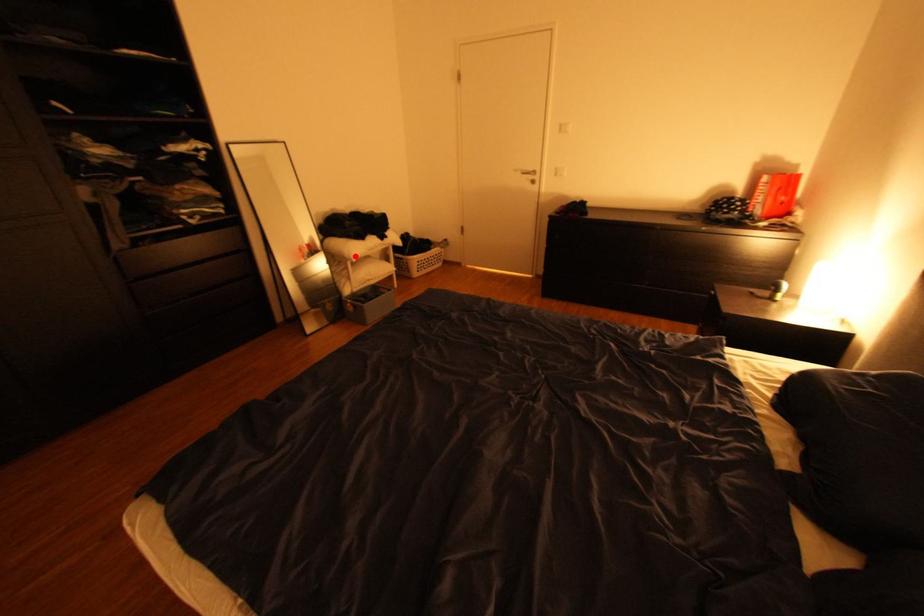
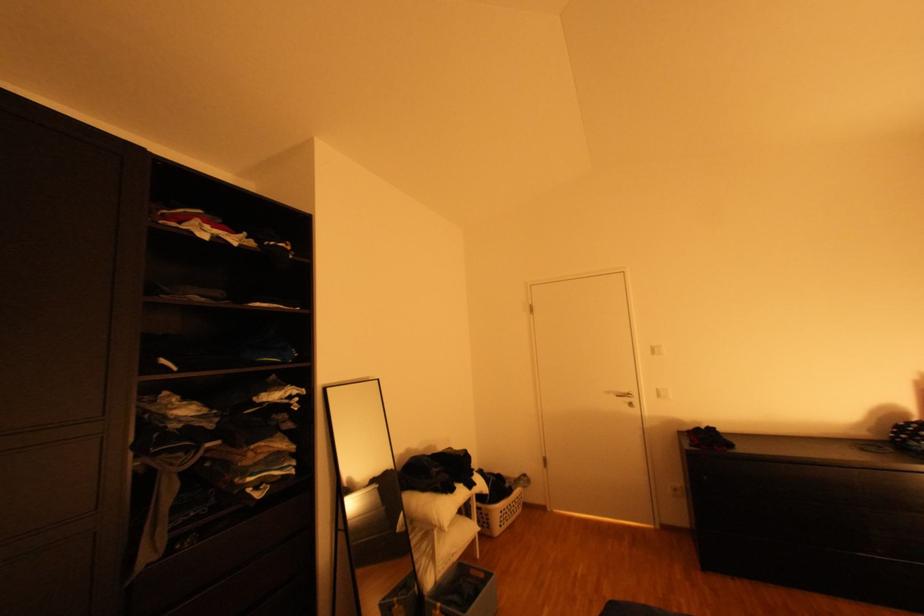
Question: I am providing you with two images of the same scene from different viewpoints. Image1 has a red point marked. In image2, the corresponding 3D location appears at what relative position? Reply with the corresponding letter.

Choices:
 (A) Closer
 (B) Farther

Answer: (B)